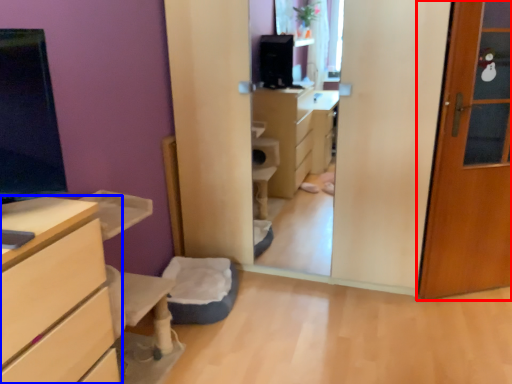
Question: Among these objects, which one is farthest to the camera, door (highlighted by a red box) or chest of drawers (highlighted by a blue box)?

Choices:
 (A) door
 (B) chest of drawers

Answer: (A)